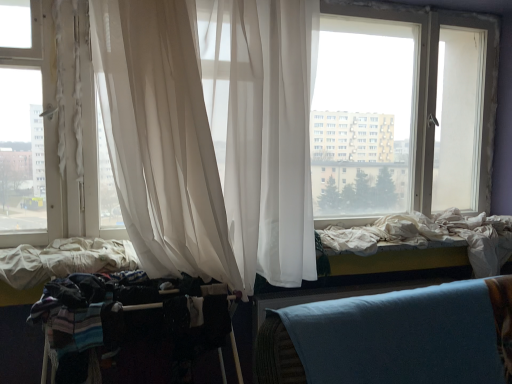
Question: Can you confirm if sheer white curtain at center is smaller than dark fabric baby carriage at lower left?

Choices:
 (A) no
 (B) yes

Answer: (A)

Question: Is sheer white curtain at center positioned in front of dark fabric baby carriage at lower left?

Choices:
 (A) yes
 (B) no

Answer: (A)

Question: Does sheer white curtain at center touch dark fabric baby carriage at lower left?

Choices:
 (A) no
 (B) yes

Answer: (A)

Question: Is sheer white curtain at center looking in the opposite direction of dark fabric baby carriage at lower left?

Choices:
 (A) no
 (B) yes

Answer: (A)

Question: Can dark fabric baby carriage at lower left be found inside sheer white curtain at center?

Choices:
 (A) no
 (B) yes

Answer: (A)

Question: Considering the relative sizes of sheer white curtain at center and dark fabric baby carriage at lower left in the image provided, is sheer white curtain at center thinner than dark fabric baby carriage at lower left?

Choices:
 (A) no
 (B) yes

Answer: (A)

Question: Could sheer white curtain at center be considered to be inside dark fabric baby carriage at lower left?

Choices:
 (A) yes
 (B) no

Answer: (B)

Question: From the image's perspective, is dark fabric baby carriage at lower left under sheer white curtain at center?

Choices:
 (A) no
 (B) yes

Answer: (B)

Question: Is dark fabric baby carriage at lower left looking in the opposite direction of sheer white curtain at center?

Choices:
 (A) yes
 (B) no

Answer: (B)

Question: Is dark fabric baby carriage at lower left far from sheer white curtain at center?

Choices:
 (A) no
 (B) yes

Answer: (A)

Question: Is dark fabric baby carriage at lower left taller than sheer white curtain at center?

Choices:
 (A) no
 (B) yes

Answer: (A)

Question: Is dark fabric baby carriage at lower left at the left side of sheer white curtain at center?

Choices:
 (A) yes
 (B) no

Answer: (A)

Question: Is sheer white curtain at center bigger or smaller than dark fabric baby carriage at lower left?

Choices:
 (A) small
 (B) big

Answer: (B)